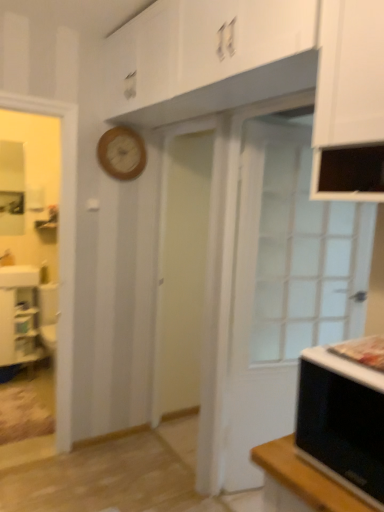
Question: From a real-world perspective, is white glass door at right on top of white glossy cabinet at lower left?

Choices:
 (A) no
 (B) yes

Answer: (B)

Question: Can you confirm if white glass door at right is bigger than white glossy cabinet at lower left?

Choices:
 (A) yes
 (B) no

Answer: (A)

Question: Does white glass door at right turn towards white glossy cabinet at lower left?

Choices:
 (A) no
 (B) yes

Answer: (A)

Question: Is white glass door at right in contact with white glossy cabinet at lower left?

Choices:
 (A) yes
 (B) no

Answer: (B)

Question: Is white glass door at right taller than white glossy cabinet at lower left?

Choices:
 (A) yes
 (B) no

Answer: (A)

Question: From a real-world perspective, is white glass door at right above or below wooden clock at upper center?

Choices:
 (A) above
 (B) below

Answer: (B)

Question: Is white glass door at right in front of or behind wooden clock at upper center in the image?

Choices:
 (A) behind
 (B) front

Answer: (B)

Question: From their relative heights in the image, would you say white glass door at right is taller or shorter than wooden clock at upper center?

Choices:
 (A) short
 (B) tall

Answer: (B)

Question: Which is correct: white glass door at right is inside wooden clock at upper center, or outside of it?

Choices:
 (A) inside
 (B) outside

Answer: (B)

Question: Looking at the image, does black matte microwave oven at lower right seem bigger or smaller compared to white glossy cabinet at lower left?

Choices:
 (A) small
 (B) big

Answer: (A)

Question: From the image's perspective, is black matte microwave oven at lower right located above or below white glossy cabinet at lower left?

Choices:
 (A) above
 (B) below

Answer: (A)

Question: Relative to white glossy cabinet at lower left, is black matte microwave oven at lower right in front or behind?

Choices:
 (A) behind
 (B) front

Answer: (B)

Question: Considering the positions of black matte microwave oven at lower right and white glossy cabinet at lower left in the image, is black matte microwave oven at lower right taller or shorter than white glossy cabinet at lower left?

Choices:
 (A) short
 (B) tall

Answer: (A)

Question: From a real-world perspective, relative to white glass door at right, is wooden clock at upper center vertically above or below?

Choices:
 (A) above
 (B) below

Answer: (A)

Question: From the image's perspective, is wooden clock at upper center positioned above or below white glass door at right?

Choices:
 (A) above
 (B) below

Answer: (A)